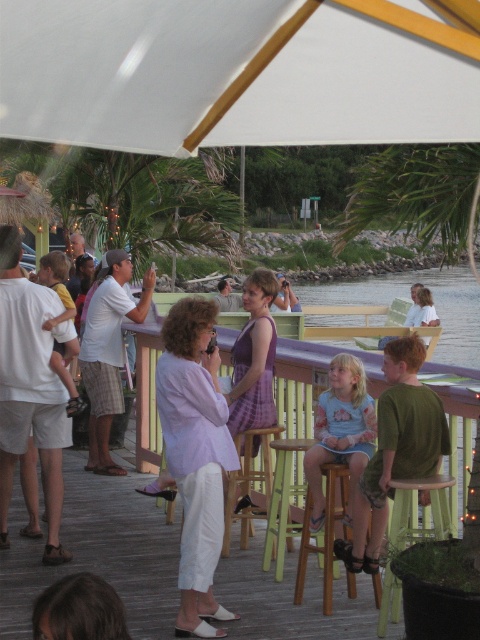
You are a photographer trying to capture a photo of the light purple fabric shirt at center and the green wood bar stool at lower right. Which object is positioned higher in the image?

The light purple fabric shirt at center is positioned higher than the green wood bar stool at lower right.

You are organizing a clothing display and need to hang the green cotton shirt at center and the purple fabric dress at center on a rack. Since the rack has limited space, which of the two items should you hang first to ensure both fit properly?

The green cotton shirt at center is thinner than the purple fabric dress at center, so you should hang the purple fabric dress at center first to accommodate its wider width, allowing the thinner green cotton shirt at center to fit alongside without overcrowding the rack.